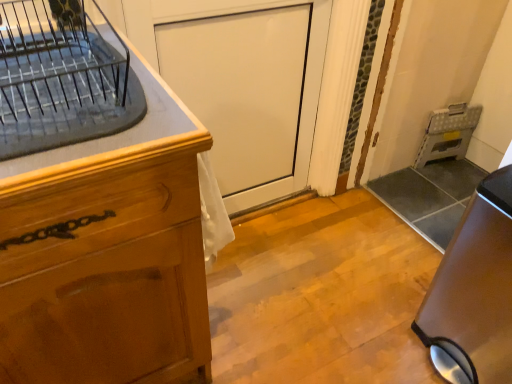
Question: From a real-world perspective, is clear glass dish rack at upper left physically located above or below white glossy door at center?

Choices:
 (A) below
 (B) above

Answer: (B)

Question: From the image's perspective, is clear glass dish rack at upper left positioned above or below white glossy door at center?

Choices:
 (A) above
 (B) below

Answer: (A)

Question: Estimate the real-world distances between objects in this image. Which object is closer to the wooden cabinet at left?

Choices:
 (A) metallic gray folding step stool at right
 (B) white glossy door at center
 (C) clear glass dish rack at upper left
 (D) satin brown trash can at lower right

Answer: (C)

Question: Estimate the real-world distances between objects in this image. Which object is farther from the clear glass dish rack at upper left?

Choices:
 (A) metallic gray folding step stool at right
 (B) white glossy door at center
 (C) wooden cabinet at left
 (D) satin brown trash can at lower right

Answer: (A)